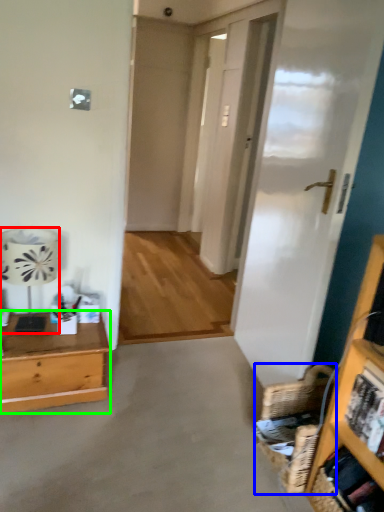
Question: Which is farther away from lamp (highlighted by a red box)? basket (highlighted by a blue box) or desk (highlighted by a green box)?

Choices:
 (A) basket
 (B) desk

Answer: (A)